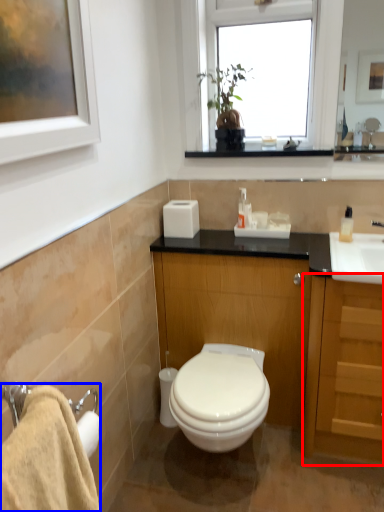
Question: Which point is further to the camera, cabinetry (highlighted by a red box) or bath towel (highlighted by a blue box)?

Choices:
 (A) cabinetry
 (B) bath towel

Answer: (A)